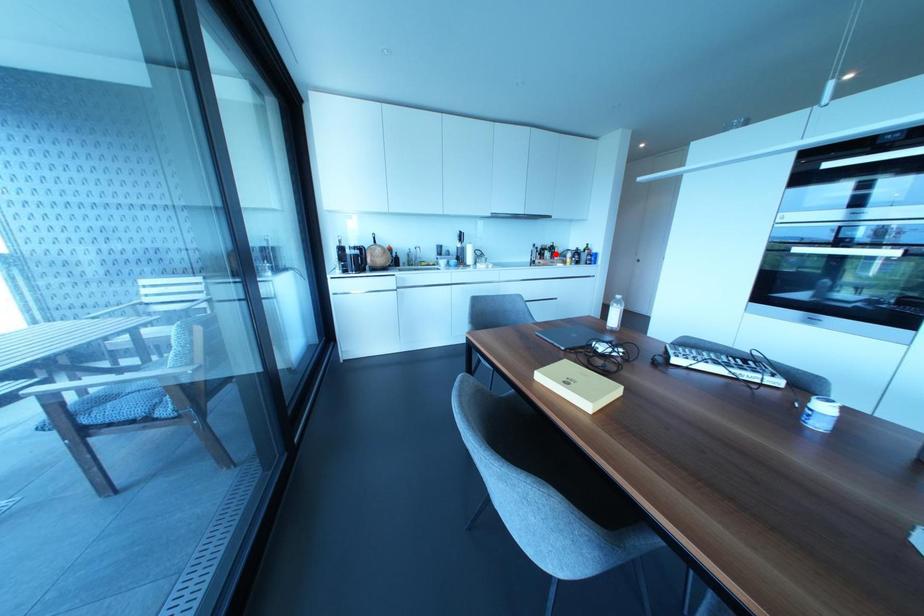
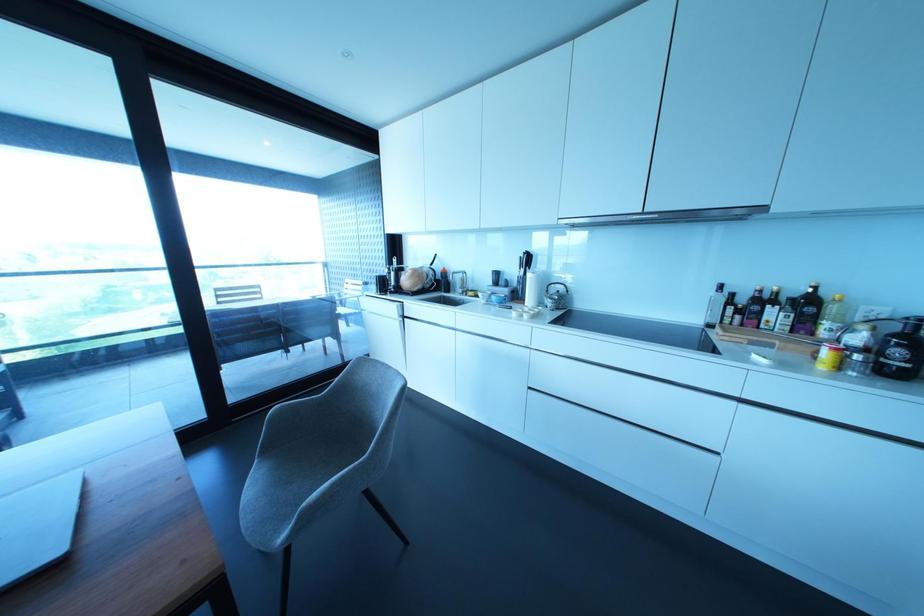
The point at the highlighted location is marked in the first image. Where is the corresponding point in the second image?

(825, 323)